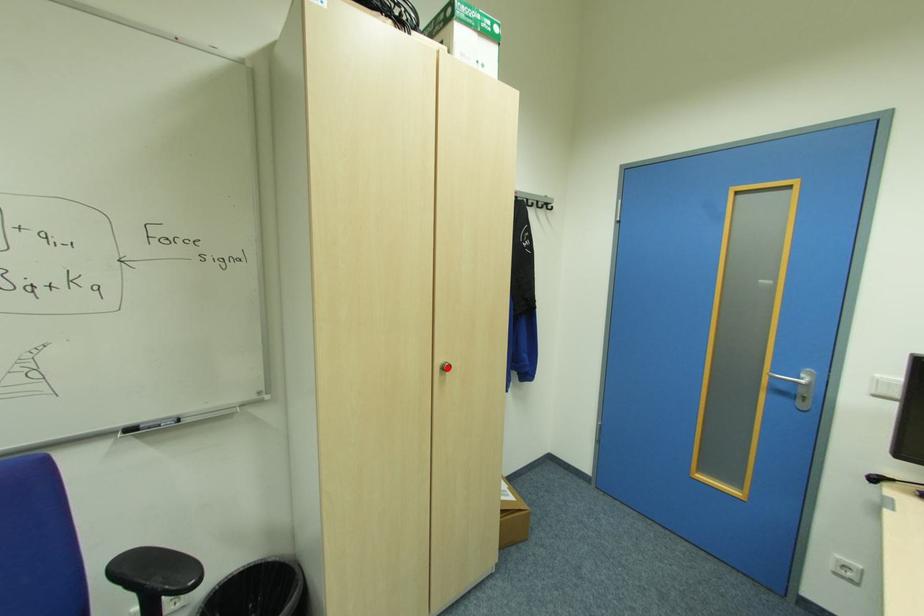
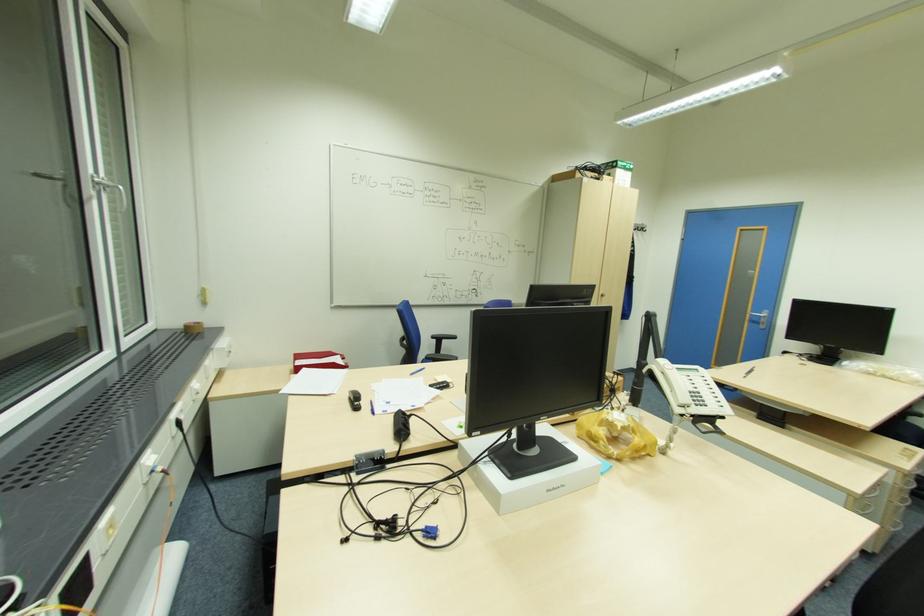
Locate, in the second image, the point that corresponds to the highlighted location in the first image.

(604, 294)